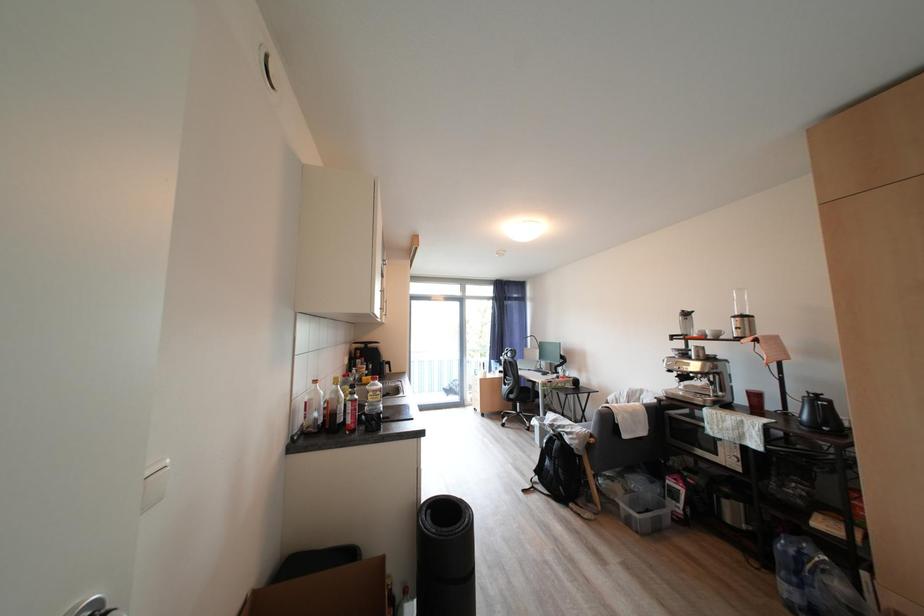
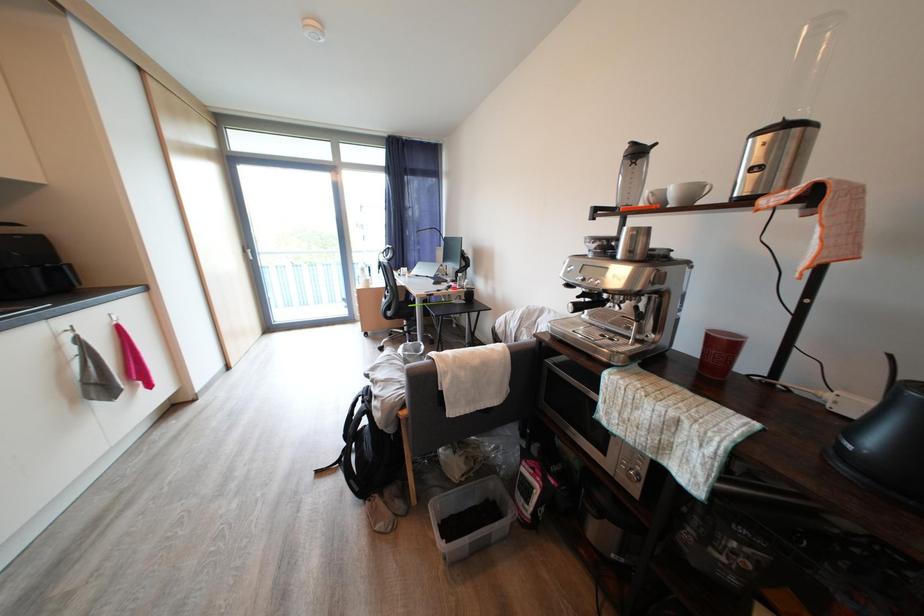
In a continuous first-person perspective shot, in which direction is the camera moving?

The cameraman walked toward right, forward.